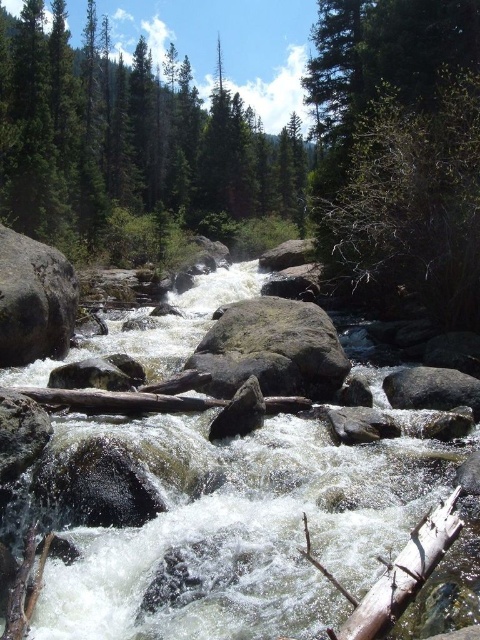
You are standing at the edge of the river and want to reach the point marked as point (37, 275). Which direction should you move relative to the point marked as point (147, 221)?

You should move downward relative to point (147, 221) to reach point (37, 275) because it is closer to the viewer.

You are a hiker trying to cross the river and see the green matte tree at upper center and the gray rough boulder at left. Which object is closer to you as you stand on the riverbank?

The green matte tree at upper center is closer to you because the gray rough boulder at left is positioned behind it.

You are standing at the riverbank and want to cross the river using a small inflatable boat that requires at least 10 feet of distance to safely launch. Can you launch your boat from your current position to the white frothy water at center?

The distance to the white frothy water at center is 12.77 feet, which is more than the required 10 feet. Therefore, you can safely launch your boat from your current position to the white frothy water at center.